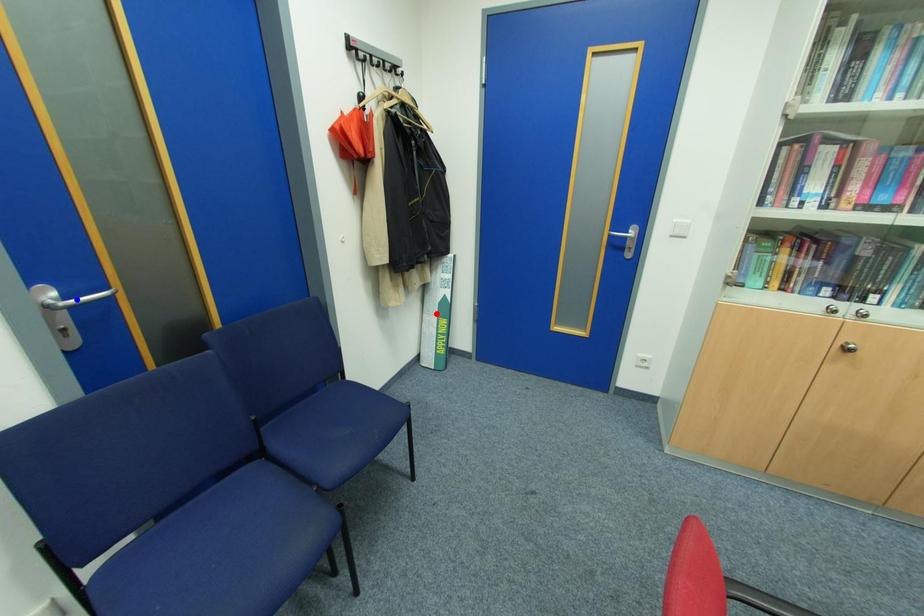
Question: Two points are marked on the image. Which point is closer to the camera?

Choices:
 (A) Blue point is closer.
 (B) Red point is closer.

Answer: (A)